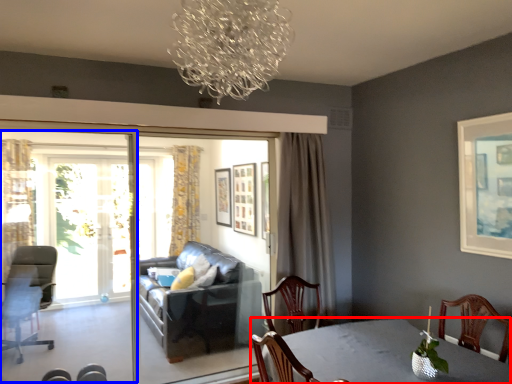
Question: Among these objects, which one is farthest to the camera, table (highlighted by a red box) or screen door (highlighted by a blue box)?

Choices:
 (A) table
 (B) screen door

Answer: (B)